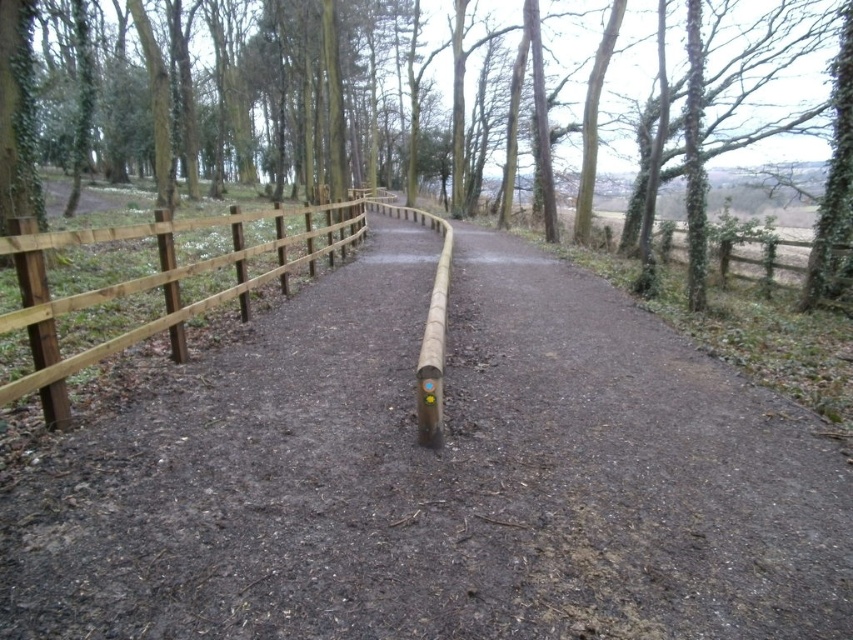
You are a hiker standing on the brown dirt path at center. You want to know if you can see over the brown wooden fence at center to check the weather. Can you see over it?

The brown dirt path at center is not as tall as brown wooden fence at center, so you cannot see over the fence.

You are a hiker trying to follow the brown dirt path at center while avoiding the brown wooden fence at center. Based on the scene, which one is narrower so you can navigate through it more easily?

The brown dirt path at center is narrower compared to the brown wooden fence at center, so it is easier to navigate through the path.